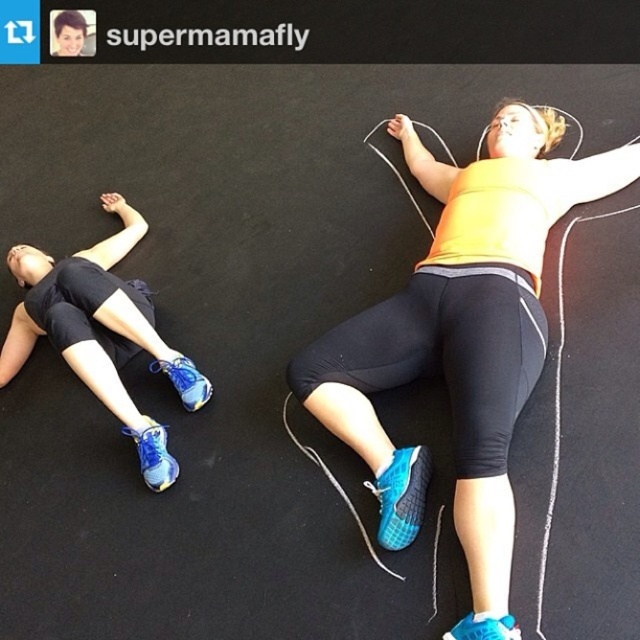
You are a fitness instructor observing two people on the mat. You need to adjust their positions so that the yellow matte tank top at center is to the left of the matte blue athletic shoe at upper left. Which individual should you move and in what direction?

The yellow matte tank top at center is currently on the right side of the matte blue athletic shoe at upper left. To move it to the left of the shoe, the individual wearing the yellow matte tank top at center should shift their body to the left.

You are a fitness instructor standing 5 feet away from the camera. You want to hand a water bottle to the person wearing the yellow matte tank top at center. Can you reach them without moving closer?

The yellow matte tank top at center is 3.87 feet away from the camera. Since you are 5 feet away from the camera, the distance between you and the person is 1.13 feet. Therefore, you can easily reach them without moving closer.